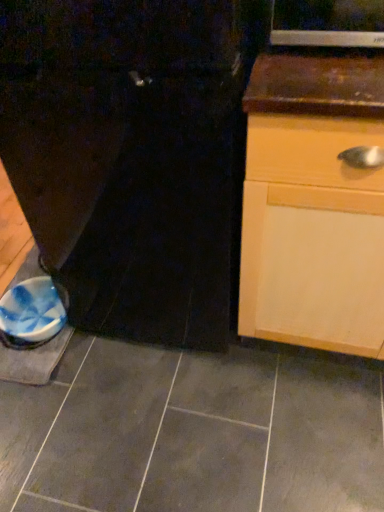
What is the approximate width of gray matte tile at center?

It is 6.27 feet.

What do you see at coordinates (192, 433) in the screenshot?
I see `gray matte tile at center` at bounding box center [192, 433].

Find the location of a particular element. This screenshot has width=384, height=512. gray matte tile at center is located at coordinates (192, 433).

The image size is (384, 512). In order to click on gray matte tile at center in this screenshot , I will do `click(192, 433)`.